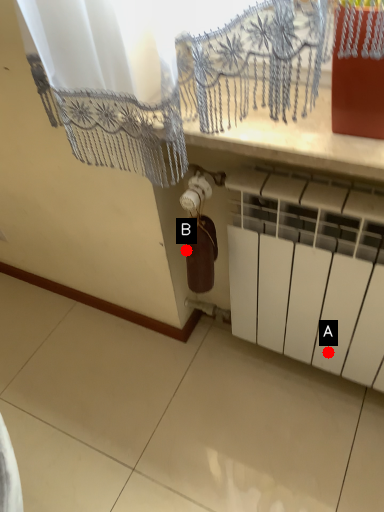
Question: Two points are circled on the image, labeled by A and B beside each circle. Among these points, which one is nearest to the camera?

Choices:
 (A) A is closer
 (B) B is closer

Answer: (A)